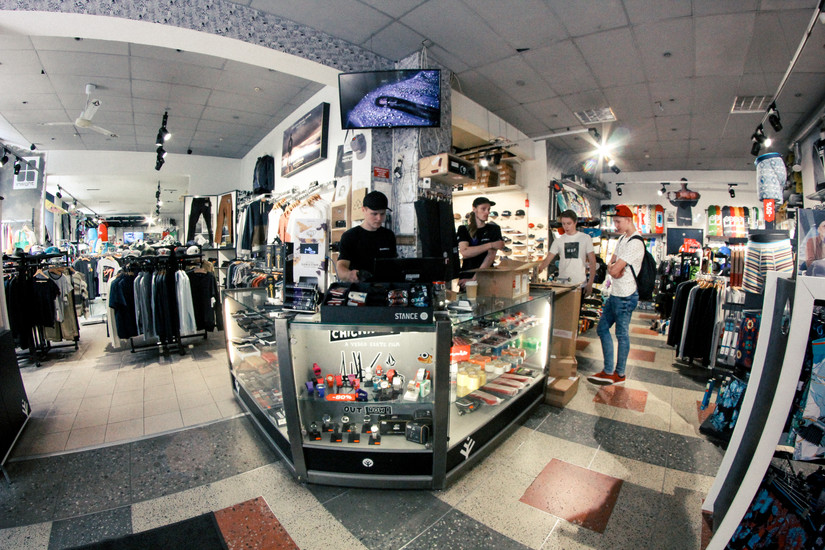
This screenshot has height=550, width=825. Find the location of `recessed ceiling lights`. recessed ceiling lights is located at coordinates (596, 114), (752, 103).